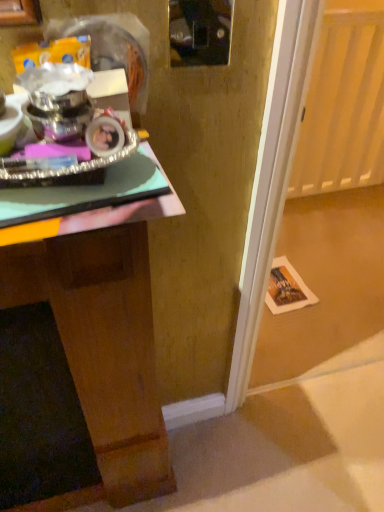
Where is `wooden desk at left`? This screenshot has width=384, height=512. wooden desk at left is located at coordinates (102, 331).

What is the approximate height of wooden desk at left?

It is 39.35 inches.

The image size is (384, 512). What do you see at coordinates (102, 331) in the screenshot?
I see `wooden desk at left` at bounding box center [102, 331].

What is the approximate height of transparent glass door at lower right?

3.82 feet.

Describe the element at coordinates (343, 103) in the screenshot. I see `transparent glass door at lower right` at that location.

This screenshot has width=384, height=512. In order to click on transparent glass door at lower right in this screenshot , I will do `click(343, 103)`.

Find the location of a particular element. wooden desk at left is located at coordinates (102, 331).

Considering the positions of objects wooden desk at left and transparent glass door at lower right in the image provided, who is more to the left, wooden desk at left or transparent glass door at lower right?

wooden desk at left.

Does wooden desk at left lie behind transparent glass door at lower right?

No.

Does point (116, 506) come in front of point (355, 34)?

That is True.

From the image's perspective, is wooden desk at left on transparent glass door at lower right?

Actually, wooden desk at left appears below transparent glass door at lower right in the image.

From a real-world perspective, which object rests below the other?

wooden desk at left.

Considering the sizes of wooden desk at left and transparent glass door at lower right in the image, is wooden desk at left wider or thinner than transparent glass door at lower right?

wooden desk at left is wider than transparent glass door at lower right.

Is wooden desk at left shorter than transparent glass door at lower right?

Yes, wooden desk at left is shorter than transparent glass door at lower right.

Considering the relative sizes of wooden desk at left and transparent glass door at lower right in the image provided, is wooden desk at left smaller than transparent glass door at lower right?

Incorrect, wooden desk at left is not smaller in size than transparent glass door at lower right.

Is wooden desk at left situated inside transparent glass door at lower right or outside?

The correct answer is: outside.

Are wooden desk at left and transparent glass door at lower right located far from each other?

That's right, there is a large distance between wooden desk at left and transparent glass door at lower right.

Could you tell me if wooden desk at left is turned towards transparent glass door at lower right?

No, wooden desk at left does not turn towards transparent glass door at lower right.

Can you tell me how much wooden desk at left and transparent glass door at lower right differ in facing direction?

There is a 0.167-degree angle between the facing directions of wooden desk at left and transparent glass door at lower right.

How much distance is there between wooden desk at left and transparent glass door at lower right?

wooden desk at left is 3.88 feet from transparent glass door at lower right.

Where is `glass door lying above the wooden desk at left (from the image's perspective)`? This screenshot has height=512, width=384. glass door lying above the wooden desk at left (from the image's perspective) is located at coordinates tap(343, 103).

Between transparent glass door at lower right and wooden desk at left, which one appears on the left side from the viewer's perspective?

wooden desk at left is more to the left.

Considering their positions, is transparent glass door at lower right located in front of or behind wooden desk at left?

transparent glass door at lower right is behind wooden desk at left.

Which is in front, point (339, 49) or point (132, 473)?

The point (132, 473) is closer to the camera.

From the image's perspective, does transparent glass door at lower right appear higher than wooden desk at left?

Yes.

From a real-world perspective, is transparent glass door at lower right located higher than wooden desk at left?

Correct, in the physical world, transparent glass door at lower right is higher than wooden desk at left.

From the picture: Looking at their sizes, would you say transparent glass door at lower right is wider or thinner than wooden desk at left?

Considering their sizes, transparent glass door at lower right looks slimmer than wooden desk at left.

Can you confirm if transparent glass door at lower right is shorter than wooden desk at left?

In fact, transparent glass door at lower right may be taller than wooden desk at left.

Which of these two, transparent glass door at lower right or wooden desk at left, is bigger?

Bigger between the two is wooden desk at left.

Which is correct: transparent glass door at lower right is inside wooden desk at left, or outside of it?

transparent glass door at lower right is outside wooden desk at left.

Is transparent glass door at lower right far from wooden desk at left?

Yes, transparent glass door at lower right is far from wooden desk at left.

Is transparent glass door at lower right oriented away from wooden desk at left?

No, transparent glass door at lower right is not facing away from wooden desk at left.

Can you tell me how much transparent glass door at lower right and wooden desk at left differ in facing direction?

They differ by 0.167 degrees in their facing directions.

Image resolution: width=384 pixels, height=512 pixels. Find the location of `desk in front of the transparent glass door at lower right`. desk in front of the transparent glass door at lower right is located at coordinates pos(102,331).

The height and width of the screenshot is (512, 384). I want to click on glass door positioned vertically above the wooden desk at left (from a real-world perspective), so (343, 103).

You are a GUI agent. You are given a task and a screenshot of the screen. Output one action in this format:
    pyautogui.click(x=<x>, y=<y>)
    Task: Click on the desk below the transparent glass door at lower right (from a real-world perspective)
    This screenshot has height=512, width=384.
    Given the screenshot: What is the action you would take?
    pyautogui.click(x=102, y=331)